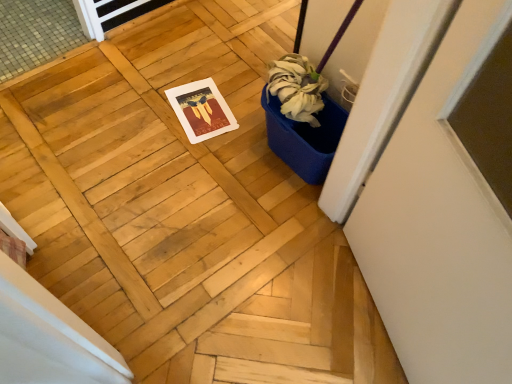
Question: Should I look upward or downward to see white matte screen door at right?

Choices:
 (A) down
 (B) up

Answer: (A)